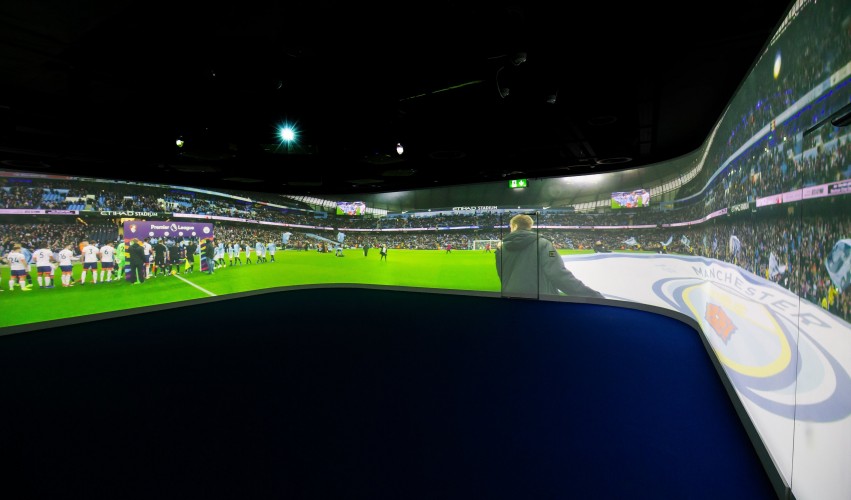
Identify the location of hood. (516, 239).